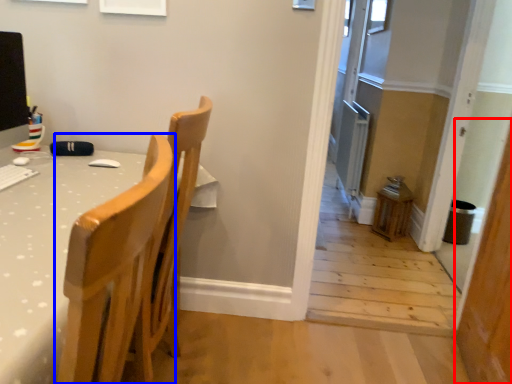
Question: Which of the following is the farthest to the observer, screen door (highlighted by a red box) or chair (highlighted by a blue box)?

Choices:
 (A) screen door
 (B) chair

Answer: (A)